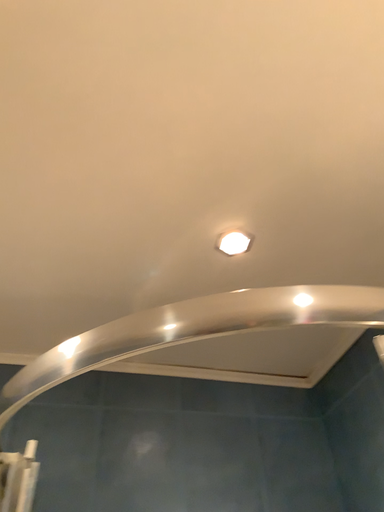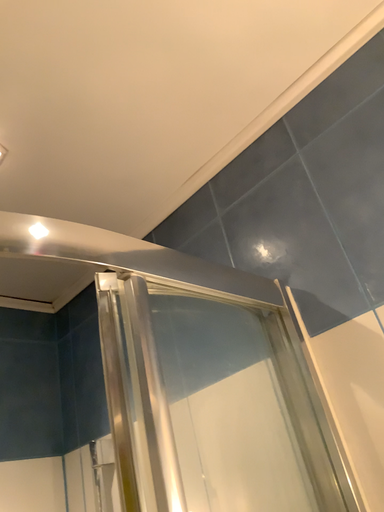
Question: How did the camera likely rotate when shooting the video?

Choices:
 (A) rotated right
 (B) rotated left

Answer: (A)